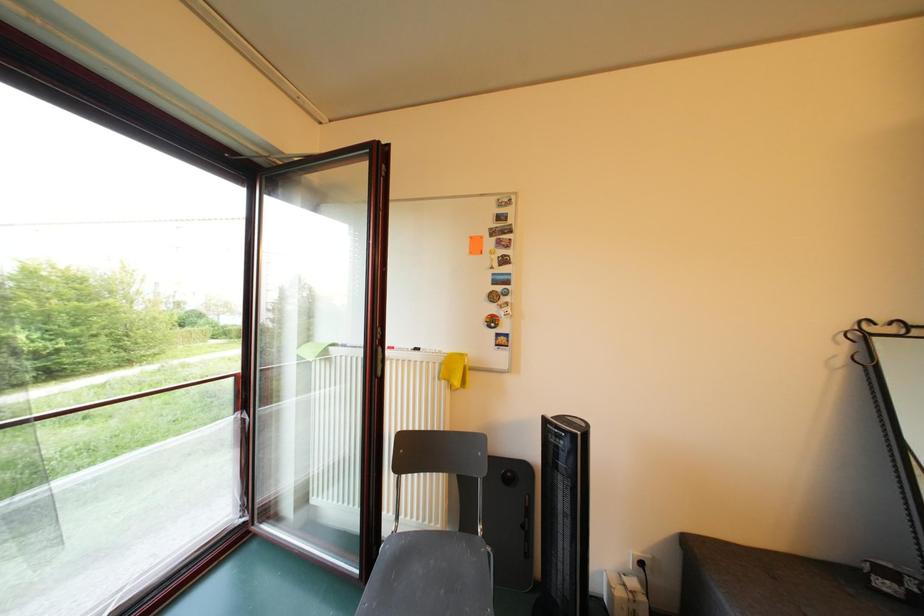
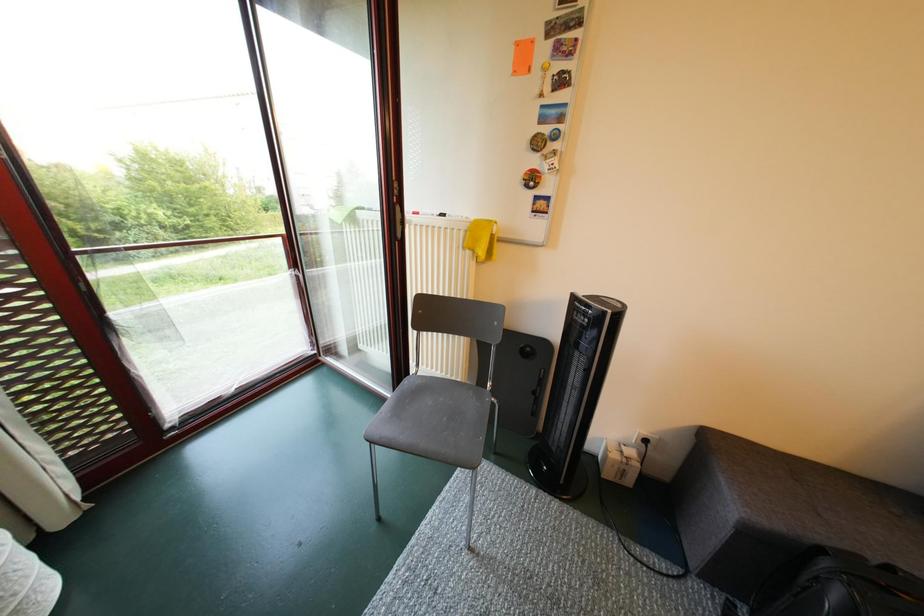
Question: The images are taken continuously from a first-person perspective. In which direction is your viewpoint rotating?

Choices:
 (A) Left
 (B) Right
 (C) Up
 (D) Down

Answer: (D)